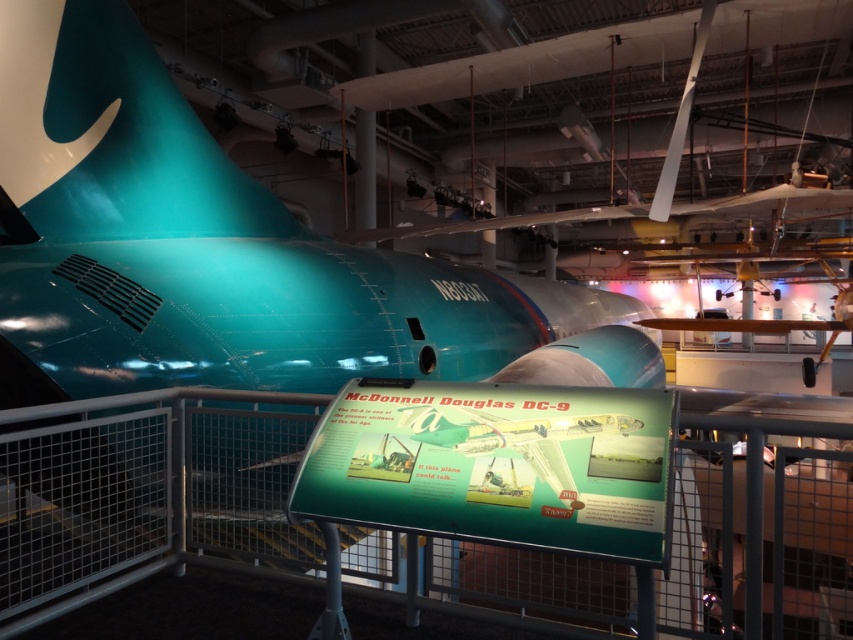
Looking at this image, you are standing in front of the museum exhibit and want to take a photo of the teal glossy airplane at center and the wooden propeller at upper center together in the frame. Given that your camera can capture objects up to 50 feet apart, will you be able to include both in a single photo?

The teal glossy airplane at center is 49.08 feet away from the wooden propeller at upper center. Since the maximum distance your camera can capture is 50 feet, you can include both in a single photo as 49.08 feet is within the 50 feet limit.